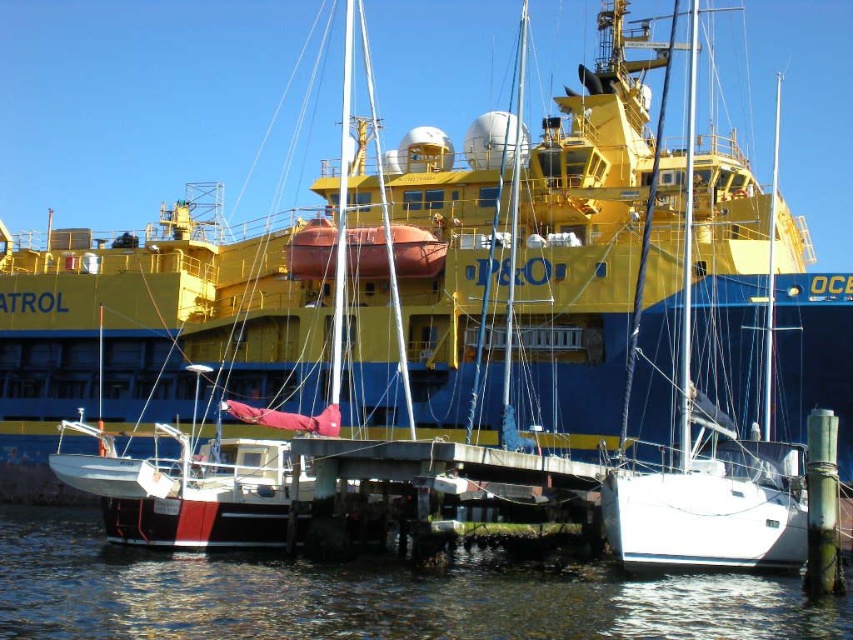
Question: Among these points, which one is farthest from the camera?

Choices:
 (A) (605, 609)
 (B) (776, 205)

Answer: (B)

Question: Is clear water at lower center below white matte sailboat at center?

Choices:
 (A) yes
 (B) no

Answer: (A)

Question: Among these objects, which one is nearest to the camera?

Choices:
 (A) white matte sailboat at center
 (B) clear water at lower center

Answer: (B)

Question: Does clear water at lower center have a greater width compared to white matte sailboat at center?

Choices:
 (A) no
 (B) yes

Answer: (B)

Question: Is clear water at lower center below white matte sailboat at center?

Choices:
 (A) no
 (B) yes

Answer: (B)